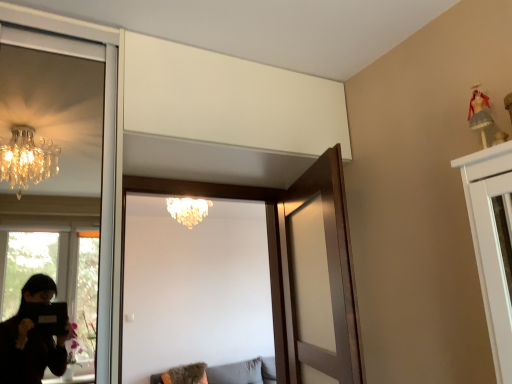
Question: From a real-world perspective, is wooden door at center, which ranks as the 2th door in left-to-right order, positioned above or below gray fabric couch at lower center?

Choices:
 (A) above
 (B) below

Answer: (A)

Question: Visually, is wooden door at center, which ranks as the 2th door in left-to-right order, positioned to the left or to the right of gray fabric couch at lower center?

Choices:
 (A) right
 (B) left

Answer: (A)

Question: Which object is the closest to the fluffy beige pillow at lower center?

Choices:
 (A) wooden door at center, acting as the 1th door starting from the right
 (B) gray fabric couch at lower center
 (C) crystal chandelier at upper center
 (D) wooden door at center, acting as the 2th door starting from the right

Answer: (B)

Question: Estimate the real-world distances between objects in this image. Which object is farther from the wooden door at center, acting as the 1th door starting from the right?

Choices:
 (A) crystal chandelier at upper center
 (B) gray fabric couch at lower center
 (C) wooden door at center, placed as the 1th door when sorted from left to right
 (D) fluffy beige pillow at lower center

Answer: (B)